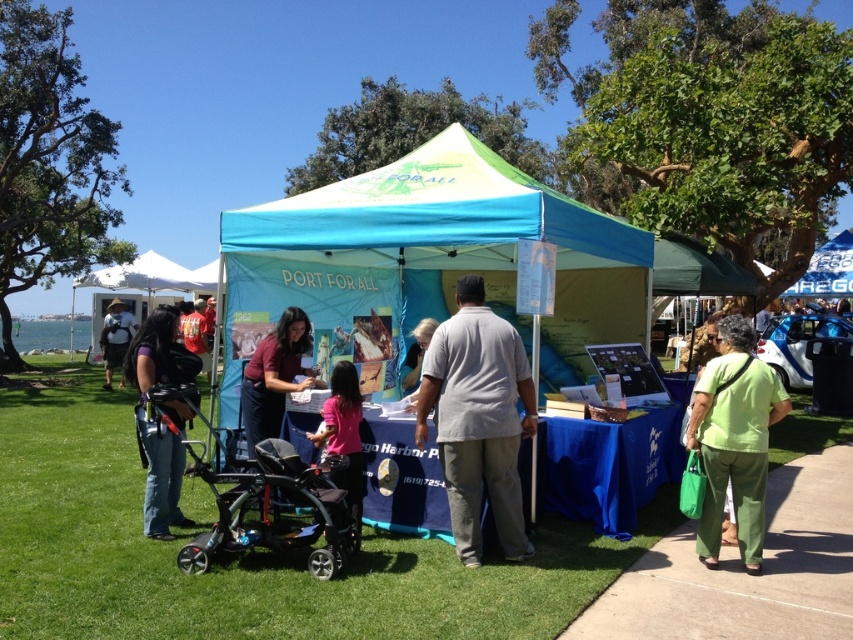
You are a visitor at the event and need to determine which object is taller between the blue fabric tent at center and the green fabric bag at lower right. Based on the scene description, which one is taller?

The green fabric bag at lower right is taller than the blue fabric tent at center according to the description.